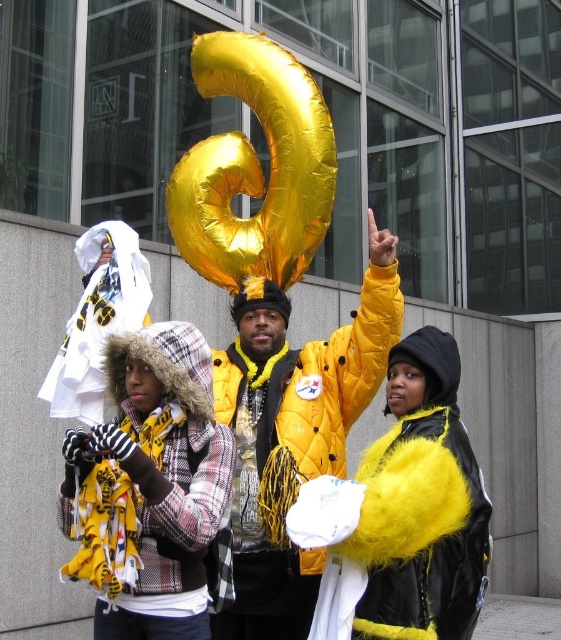
Does fuzzy yellow jacket at center have a greater height compared to yellow quilted jacket at center?

Yes.

This screenshot has height=640, width=561. I want to click on fuzzy yellow jacket at center, so click(403, 513).

In order to click on fuzzy yellow jacket at center in this screenshot , I will do `click(403, 513)`.

Looking at this image, does plaid fabric hooded jacket at left have a lesser width compared to gold metallic balloon at center?

Correct, plaid fabric hooded jacket at left's width is less than gold metallic balloon at center's.

Between point (204, 636) and point (252, 80), which one is positioned behind?

Positioned behind is point (252, 80).

You are a GUI agent. You are given a task and a screenshot of the screen. Output one action in this format:
    pyautogui.click(x=<x>, y=<y>)
    Task: Click on the plaid fabric hooded jacket at left
    The height and width of the screenshot is (640, 561).
    Given the screenshot: What is the action you would take?
    pyautogui.click(x=154, y=484)

Between fuzzy yellow jacket at center and gold metallic balloon at center, which one has more height?

gold metallic balloon at center

Can you confirm if fuzzy yellow jacket at center is smaller than gold metallic balloon at center?

Yes.

Locate an element on the screen. The width and height of the screenshot is (561, 640). fuzzy yellow jacket at center is located at coordinates (403, 513).